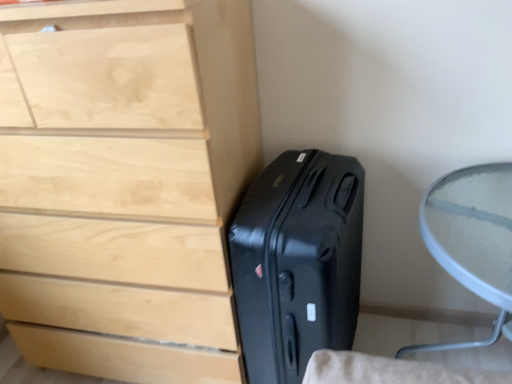
Question: Considering the relative sizes of black hardshell suitcase at lower right and light wood chest of drawers at left in the image provided, is black hardshell suitcase at lower right wider than light wood chest of drawers at left?

Choices:
 (A) yes
 (B) no

Answer: (A)

Question: Would you say light wood chest of drawers at left is part of black hardshell suitcase at lower right's contents?

Choices:
 (A) yes
 (B) no

Answer: (B)

Question: Is black hardshell suitcase at lower right positioned beyond the bounds of light wood chest of drawers at left?

Choices:
 (A) yes
 (B) no

Answer: (A)

Question: From a real-world perspective, is black hardshell suitcase at lower right on top of light wood chest of drawers at left?

Choices:
 (A) no
 (B) yes

Answer: (A)

Question: Would you say black hardshell suitcase at lower right is a long distance from light wood chest of drawers at left?

Choices:
 (A) yes
 (B) no

Answer: (B)

Question: From the image's perspective, is black hardshell suitcase at lower right on light wood chest of drawers at left?

Choices:
 (A) no
 (B) yes

Answer: (A)

Question: Is transparent glass table at right at the left side of black hardshell suitcase at lower right?

Choices:
 (A) no
 (B) yes

Answer: (A)

Question: From a real-world perspective, is transparent glass table at right physically below black hardshell suitcase at lower right?

Choices:
 (A) yes
 (B) no

Answer: (B)

Question: Considering the relative sizes of transparent glass table at right and black hardshell suitcase at lower right in the image provided, is transparent glass table at right smaller than black hardshell suitcase at lower right?

Choices:
 (A) no
 (B) yes

Answer: (A)

Question: Is transparent glass table at right positioned with its back to black hardshell suitcase at lower right?

Choices:
 (A) yes
 (B) no

Answer: (B)

Question: Is black hardshell suitcase at lower right surrounded by transparent glass table at right?

Choices:
 (A) no
 (B) yes

Answer: (A)

Question: From the image's perspective, is transparent glass table at right on black hardshell suitcase at lower right?

Choices:
 (A) yes
 (B) no

Answer: (B)

Question: Can you confirm if light wood chest of drawers at left is smaller than transparent glass table at right?

Choices:
 (A) no
 (B) yes

Answer: (A)